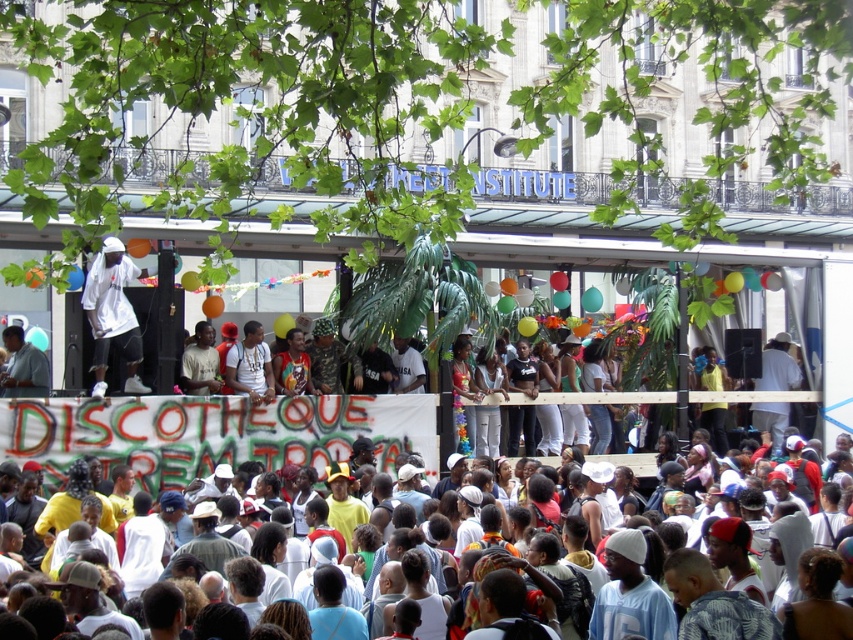
Looking at this image, you are organizing a photo shoot and need to ensure that both the white cotton crowd at center and the white matte clothing at center are visible in the frame. Based on their spatial relationship, which object should you prioritize positioning closer to the camera to ensure visibility?

The white cotton crowd at center is wider than white matte clothing at center, so you should prioritize positioning the white cotton crowd at center closer to the camera to ensure visibility.

You are a photographer at the event and want to capture both the white matte clothing at center and the white matte shirt at center in a single photo. Which one will appear larger in the photo?

The white matte clothing at center will appear larger in the photo because it is closer to the viewer than the white matte shirt at center.